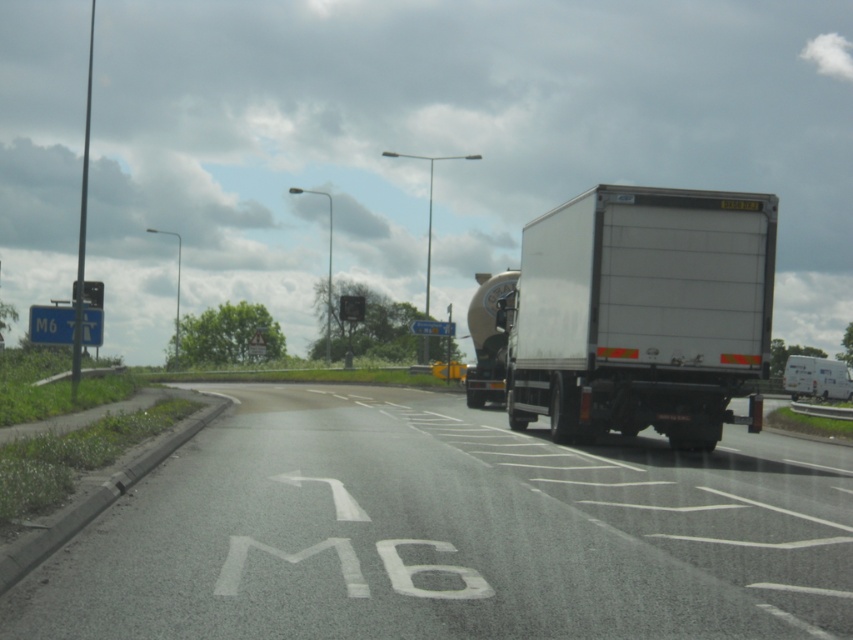
Question: Is white asphalt road at lower left to the left of white matte trailer truck at center from the viewer's perspective?

Choices:
 (A) no
 (B) yes

Answer: (B)

Question: Which of the following is the farthest from the observer?

Choices:
 (A) (601, 266)
 (B) (703, 563)
 (C) (827, 396)

Answer: (C)

Question: Which is nearer to the white matte truck at right?

Choices:
 (A) white matte trailer truck at center
 (B) white asphalt road at lower left

Answer: (A)

Question: Which point is farther from the camera taking this photo?

Choices:
 (A) pyautogui.click(x=248, y=518)
 (B) pyautogui.click(x=639, y=221)

Answer: (B)

Question: Is the position of white asphalt road at lower left more distant than that of white matte truck at right?

Choices:
 (A) yes
 (B) no

Answer: (B)

Question: Can you confirm if white matte trailer truck at center is wider than white matte truck at right?

Choices:
 (A) yes
 (B) no

Answer: (B)